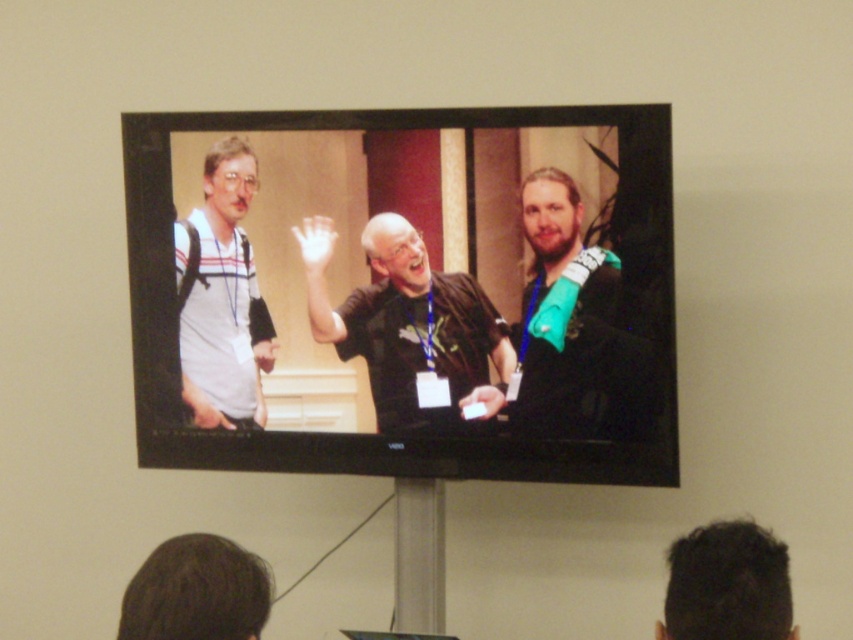
Question: Can you confirm if black matte shirt at center is wider than white striped shirt at left?

Choices:
 (A) yes
 (B) no

Answer: (A)

Question: Does black matte shirt at center appear on the left side of teal fabric arm at right?

Choices:
 (A) yes
 (B) no

Answer: (A)

Question: Which object is positioned farthest from the white striped shirt at left?

Choices:
 (A) teal fabric arm at right
 (B) matte black tv at center

Answer: (A)

Question: Which of the following is the farthest from the observer?

Choices:
 (A) (589, 419)
 (B) (218, 385)
 (C) (593, 282)
 (D) (454, 388)

Answer: (B)

Question: Is black matte shirt at center below white striped shirt at left?

Choices:
 (A) no
 (B) yes

Answer: (B)

Question: Which is farther from the teal fabric arm at right?

Choices:
 (A) black matte shirt at center
 (B) white striped shirt at left
 (C) matte black tv at center

Answer: (B)